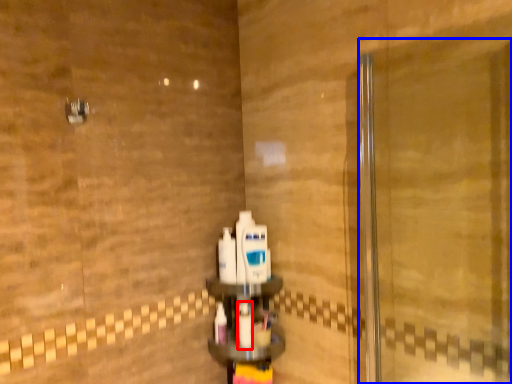
Question: Which object appears farthest to the camera in this image, mouthwash (highlighted by a red box) or screen door (highlighted by a blue box)?

Choices:
 (A) mouthwash
 (B) screen door

Answer: (A)